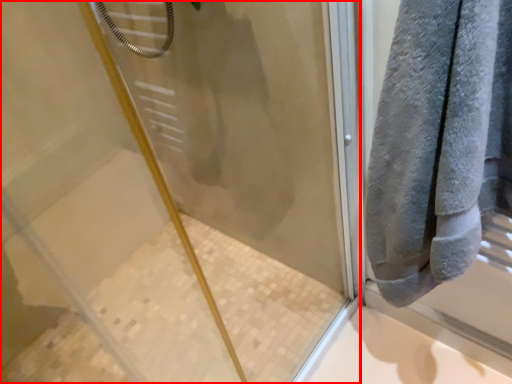
Question: In this image, where is screen door (annotated by the red box) located relative to towel?

Choices:
 (A) right
 (B) left

Answer: (B)